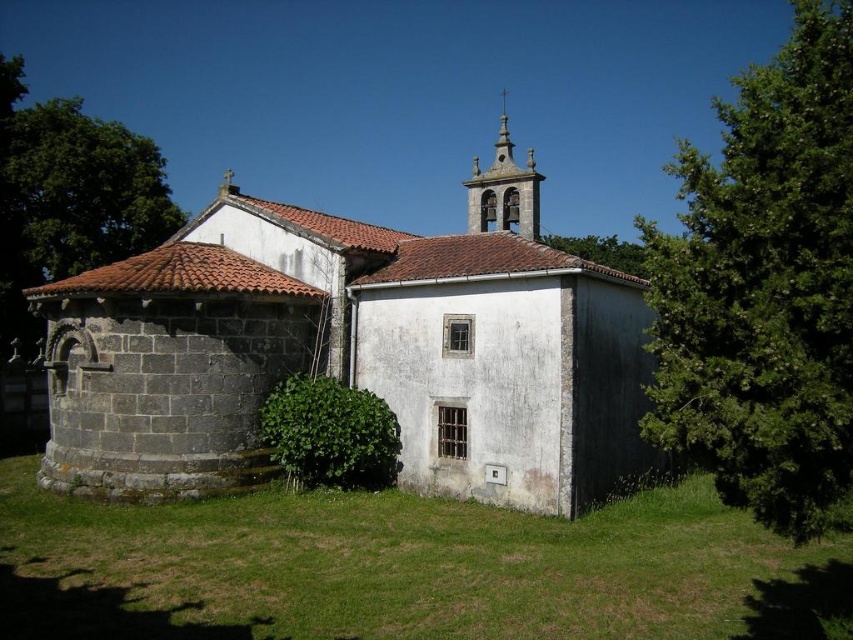
Question: Does gray stone church at center have a smaller size compared to smooth stone bell tower at upper center?

Choices:
 (A) no
 (B) yes

Answer: (B)

Question: Is gray stone church at center closer to camera compared to smooth stone bell tower at upper center?

Choices:
 (A) yes
 (B) no

Answer: (A)

Question: Considering the real-world distances, which object is closest to the green leafy tree at upper left?

Choices:
 (A) green leafy tree at upper center
 (B) gray stone church at center
 (C) green leafy tree at right
 (D) smooth stone bell tower at upper center

Answer: (B)

Question: Is green leafy tree at right smaller than green leafy tree at upper left?

Choices:
 (A) yes
 (B) no

Answer: (B)

Question: Which object is positioned closest to the green leafy tree at upper left?

Choices:
 (A) gray stone church at center
 (B) smooth stone bell tower at upper center
 (C) green leafy tree at right

Answer: (A)

Question: Which point appears farthest from the camera in this image?

Choices:
 (A) (579, 257)
 (B) (805, 227)
 (C) (143, 150)

Answer: (A)